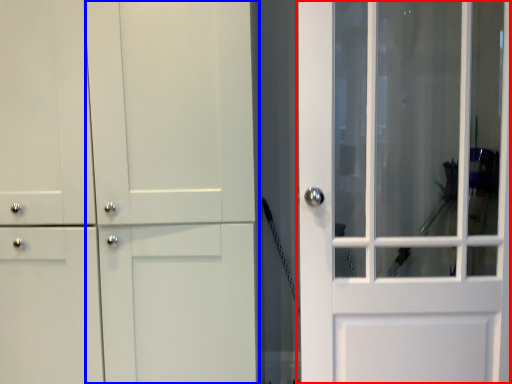
Question: Which object is closer to the camera taking this photo, door (highlighted by a red box) or barn door (highlighted by a blue box)?

Choices:
 (A) door
 (B) barn door

Answer: (B)